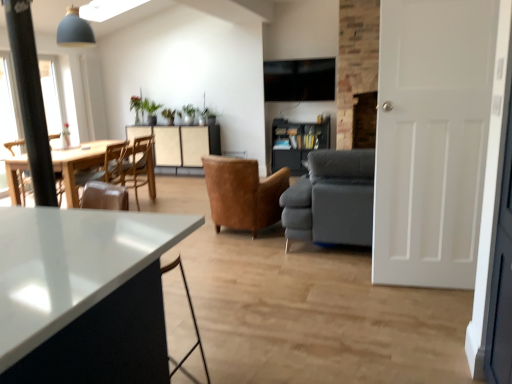
Question: Visually, is beige textured cabinet at center positioned to the left or to the right of white matte door at right?

Choices:
 (A) left
 (B) right

Answer: (A)

Question: Is beige textured cabinet at center situated inside white matte door at right or outside?

Choices:
 (A) inside
 (B) outside

Answer: (B)

Question: Considering the real-world distances, which object is farthest from the green leafy plant at center?

Choices:
 (A) dark wood bookshelf at center
 (B) white matte door at right
 (C) dark gray fabric couch at center
 (D) wooden chair at left, which ranks as the second chair in right-to-left order
 (E) beige textured cabinet at center

Answer: (B)

Question: Which object is the farthest from the beige textured cabinet at center?

Choices:
 (A) white matte door at right
 (B) wooden chair at left, which ranks as the second chair in right-to-left order
 (C) brown leather chair at left, positioned as the first chair in left-to-right order
 (D) leather armchair at center, the third chair in the left-to-right sequence
 (E) green matte plant at upper center

Answer: (A)